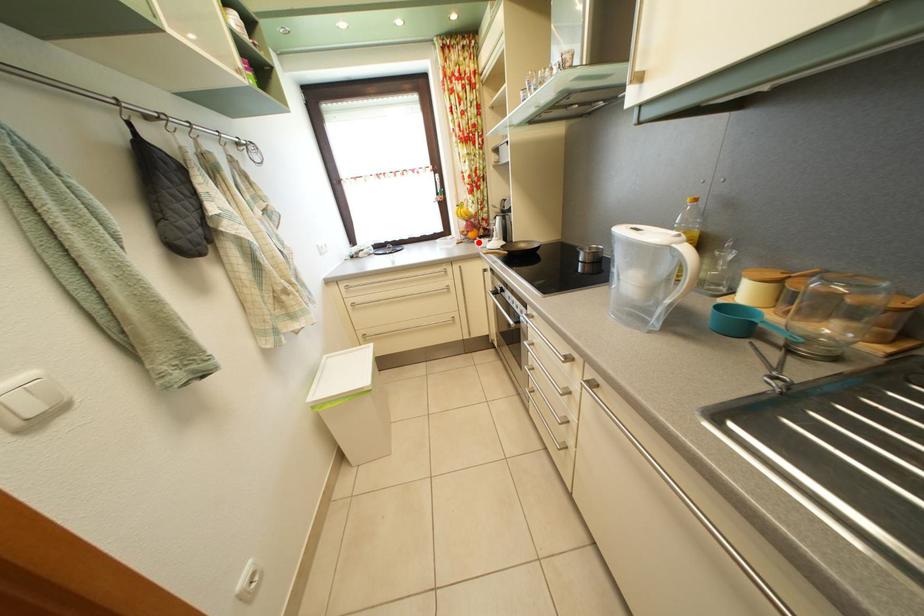
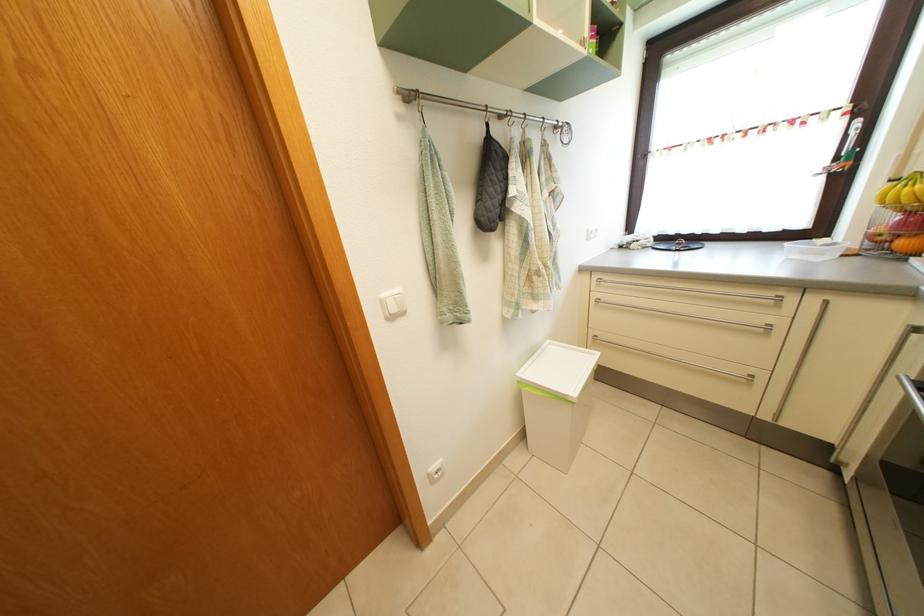
Question: I am providing you with two images of the same scene from different viewpoints. Image1 has a red point marked. In image2, the corresponding 3D location appears at what relative position? Reply with the corresponding letter.

Choices:
 (A) Closer
 (B) Farther

Answer: (B)